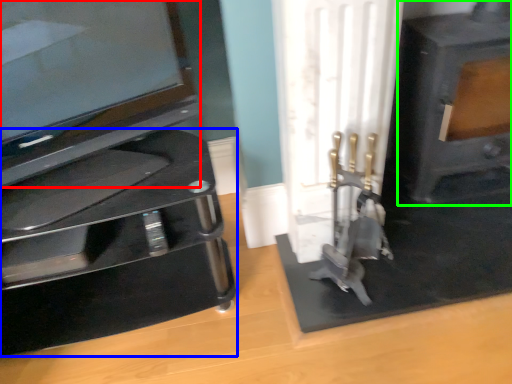
Question: Estimate the real-world distances between objects in this image. Which object is closer to television (highlighted by a red box), furniture (highlighted by a blue box) or fireplace (highlighted by a green box)?

Choices:
 (A) furniture
 (B) fireplace

Answer: (A)